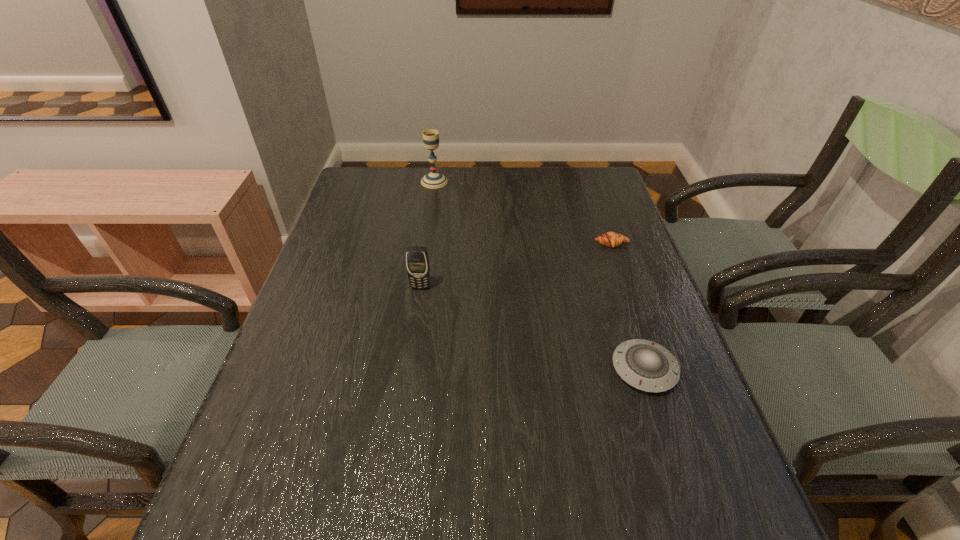
You are a GUI agent. You are given a task and a screenshot of the screen. Output one action in this format:
    pyautogui.click(x=<x>, y=<y>)
    Task: Click on the object that is the third closest to the second nearest object
    The height and width of the screenshot is (540, 960).
    Given the screenshot: What is the action you would take?
    pyautogui.click(x=610, y=239)

I want to click on free space that satisfies the following two spatial constraints: 1. on the front face of the nearest object; 2. on the left side of the cellular telephone, so click(409, 369).

Where is `blank area in the image that satisfies the following two spatial constraints: 1. on the front side of the chalice; 2. on the left side of the nearest object`? blank area in the image that satisfies the following two spatial constraints: 1. on the front side of the chalice; 2. on the left side of the nearest object is located at coordinates (407, 369).